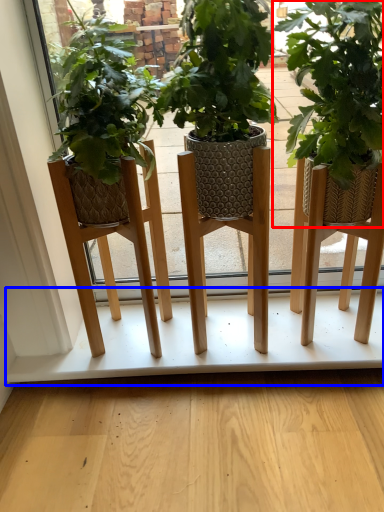
Question: Which object is closer to the camera taking this photo, houseplant (highlighted by a red box) or shelf (highlighted by a blue box)?

Choices:
 (A) houseplant
 (B) shelf

Answer: (A)